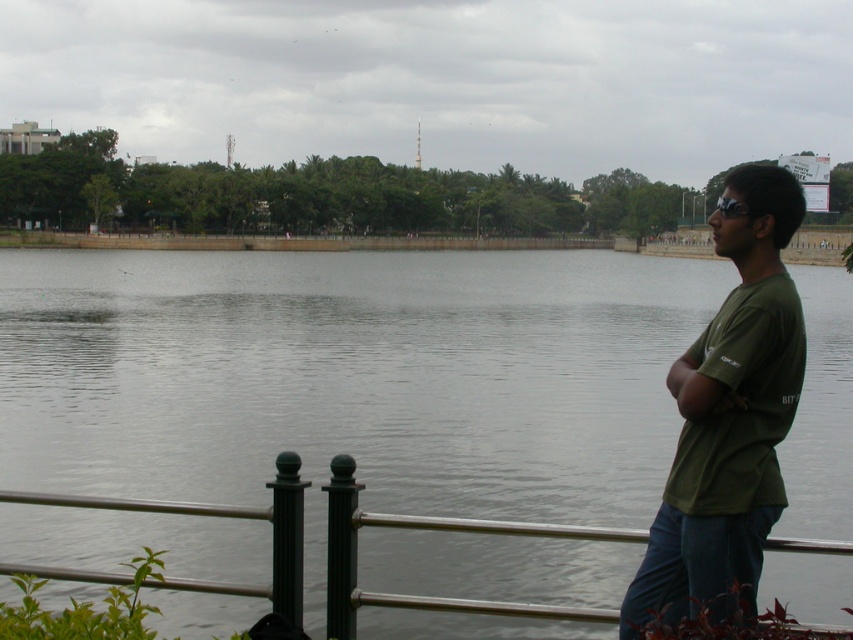
Question: Which object is the farthest from the metallic silver rail at lower center?

Choices:
 (A) gray water at center
 (B) green matte shirt at right

Answer: (A)

Question: Can you confirm if metallic silver rail at lower center is smaller than black matte goggles at upper right?

Choices:
 (A) yes
 (B) no

Answer: (A)

Question: Which object is the farthest from the green matte shirt at right?

Choices:
 (A) metallic silver rail at lower center
 (B) black matte goggles at upper right

Answer: (B)

Question: Can you confirm if metallic silver rail at lower center is positioned above black matte goggles at upper right?

Choices:
 (A) yes
 (B) no

Answer: (B)

Question: Is gray water at center smaller than black matte goggles at upper right?

Choices:
 (A) yes
 (B) no

Answer: (A)

Question: Which point is farther to the camera?

Choices:
 (A) black matte goggles at upper right
 (B) green matte shirt at right
 (C) gray water at center
 (D) metallic silver rail at lower center

Answer: (C)